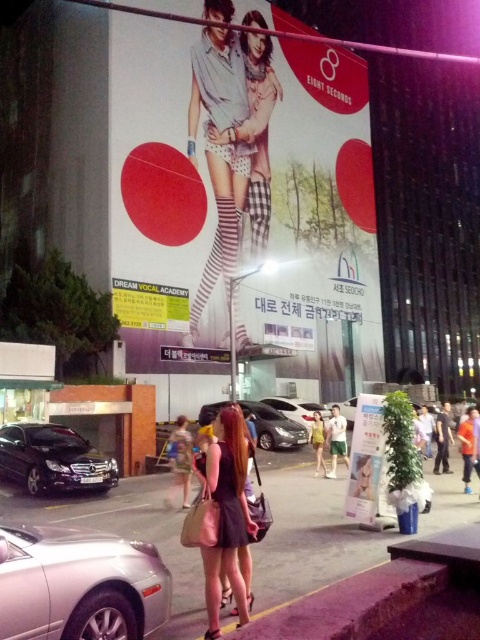
You are a delivery person who needs to place a new rectangular package that is 2 meters wide on the matte white poster at center or the shiny black car at lower left. Which object can accommodate the package based on their widths?

The matte white poster at center has a larger width than the shiny black car at lower left, so the package can be placed on the matte white poster at center.

You are standing on the sidewalk in the urban street scene. There are two points marked in the image. The first point is at coordinate point (277, 483) and the second point is at coordinate point (23, 428). If you were to walk towards the first point, would you pass by the second point before reaching the first one?

Point (277, 483) is in front of point (23, 428), so if you walk towards the first point, you would not pass by the second point before reaching the first one because the first point is closer to your current position.